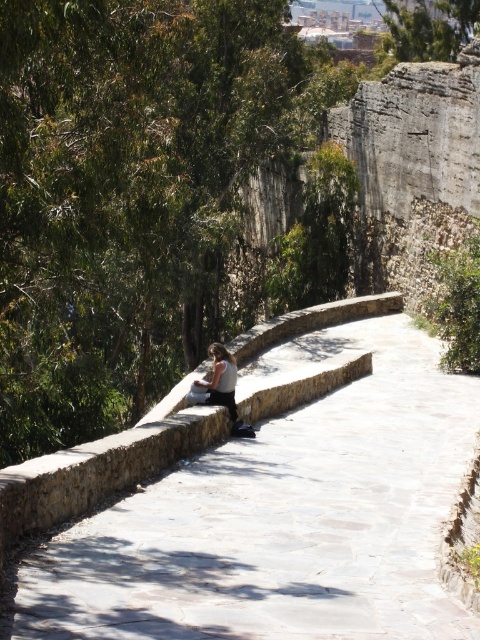
Is stone paved path at center positioned at the back of green leafy tree at upper center?

No, it is not.

Is point (414, 413) farther from camera compared to point (409, 28)?

No.

Where is `stone paved path at center`? Image resolution: width=480 pixels, height=640 pixels. stone paved path at center is located at coordinates (280, 516).

Between stone paved path at center and matte white shirt at center, which one has less height?

With less height is matte white shirt at center.

Is point (206, 550) farther from viewer compared to point (213, 387)?

No.

I want to click on stone paved path at center, so click(280, 516).

Does point (399, 38) come in front of point (212, 378)?

No.

Describe the element at coordinates (430, 28) in the screenshot. I see `green leafy tree at upper center` at that location.

I want to click on green leafy tree at upper center, so click(x=430, y=28).